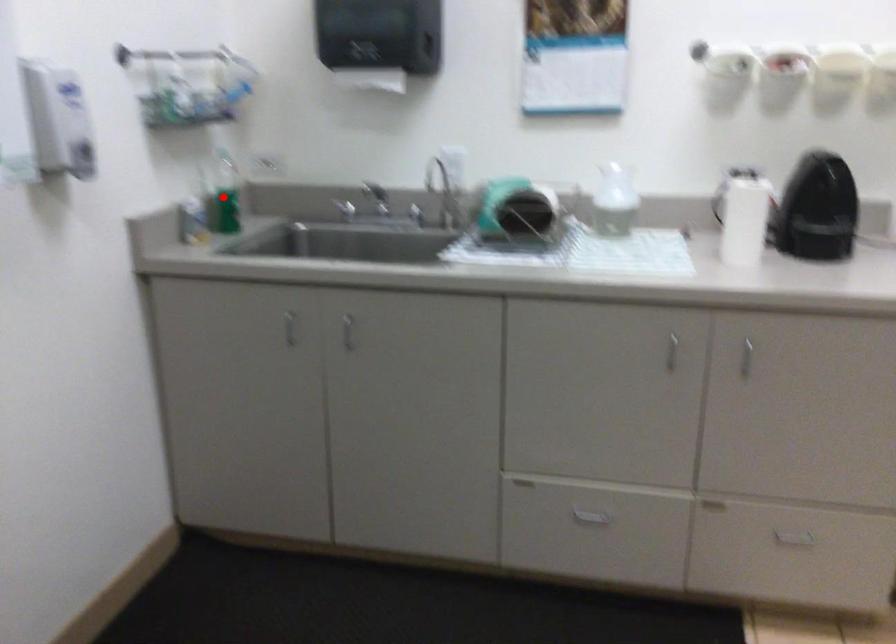
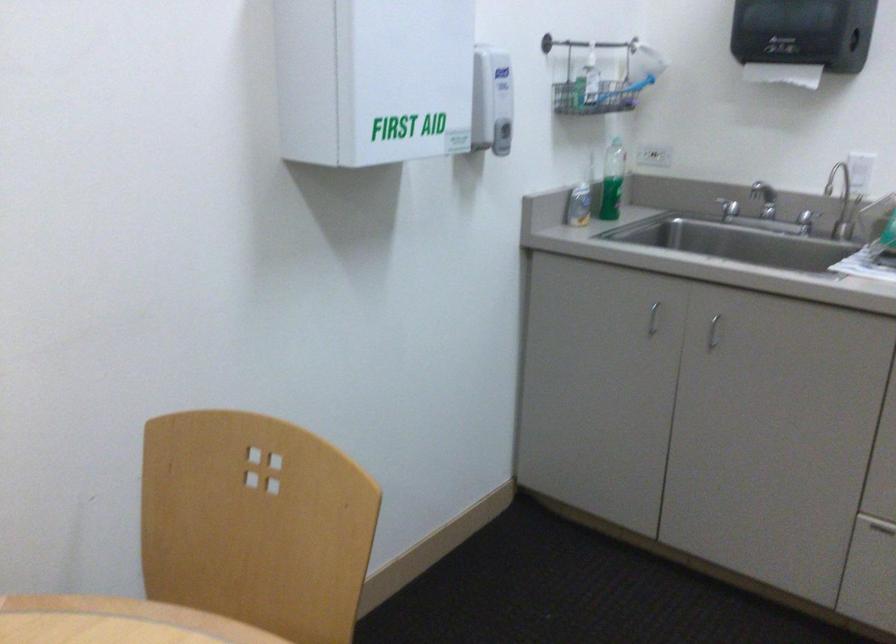
Where in the second image is the point corresponding to the highlighted location from the first image?

(613, 181)